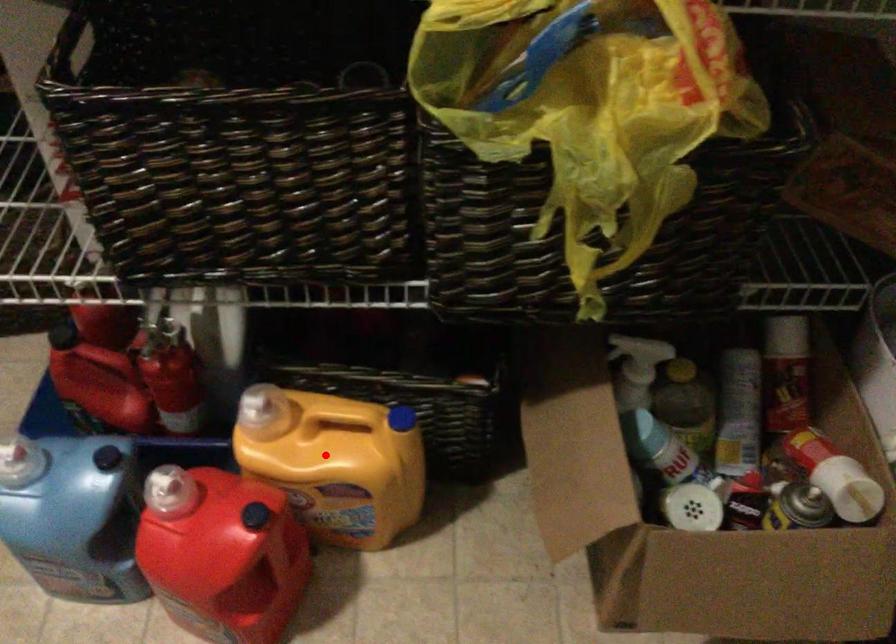
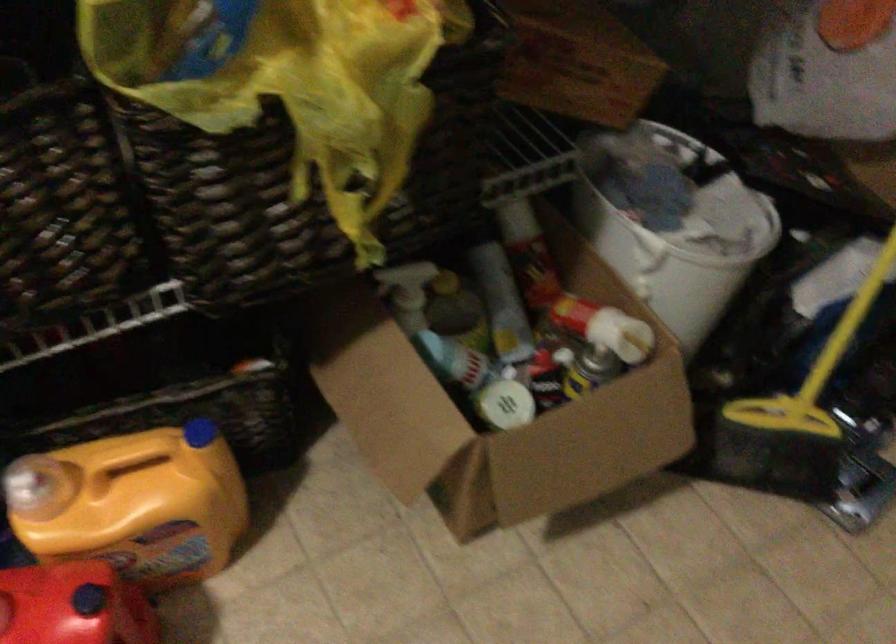
Question: I am providing you with two images of the same scene from different viewpoints. In image1, a red point is highlighted. Considering the same 3D point in image2, which of the following is correct?

Choices:
 (A) It is closer
 (B) It is farther

Answer: (A)